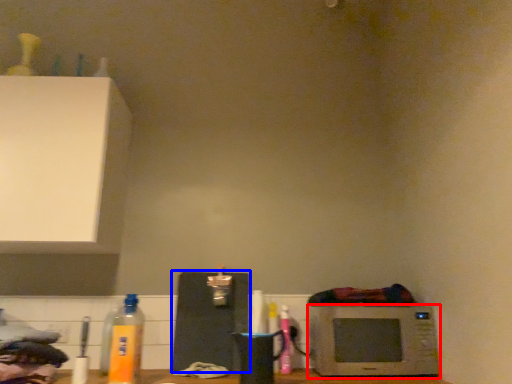
Question: Which object appears closest to the camera in this image, microwave oven (highlighted by a red box) or appliance (highlighted by a blue box)?

Choices:
 (A) microwave oven
 (B) appliance

Answer: (A)